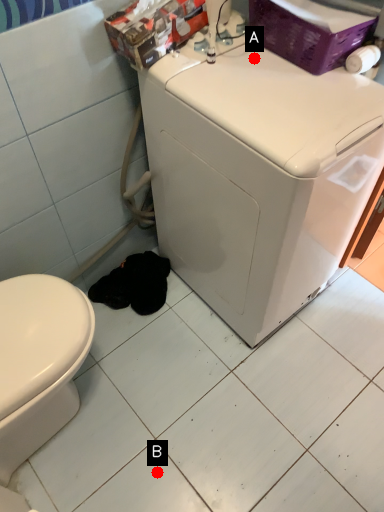
Question: Two points are circled on the image, labeled by A and B beside each circle. Which point is further to the camera?

Choices:
 (A) A is further
 (B) B is further

Answer: (B)